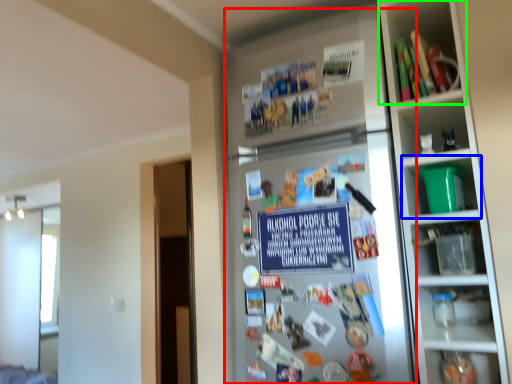
Question: Which object is the farthest from fridge (highlighted by a red box)? Choose among these: shelf (highlighted by a blue box) or shelf (highlighted by a green box).

Choices:
 (A) shelf
 (B) shelf

Answer: (B)